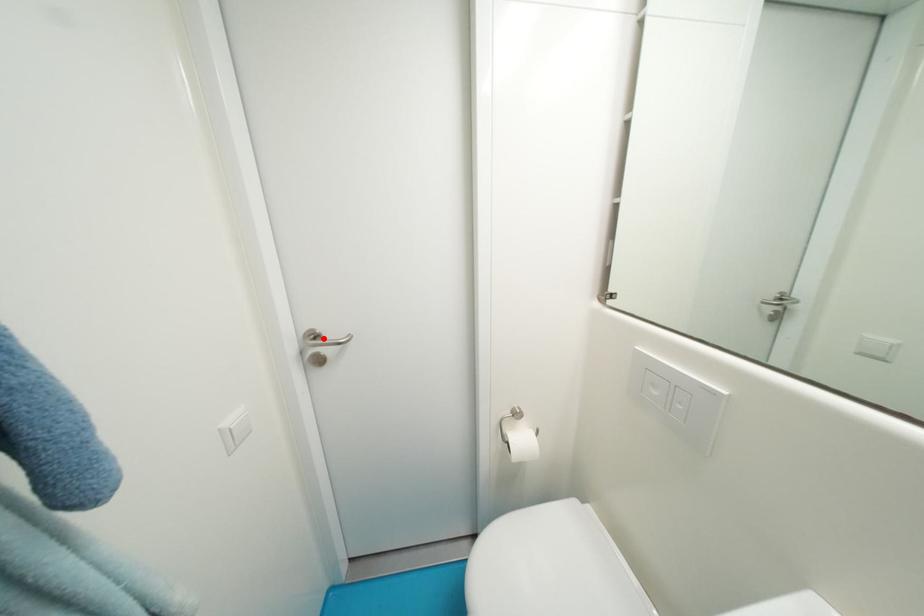
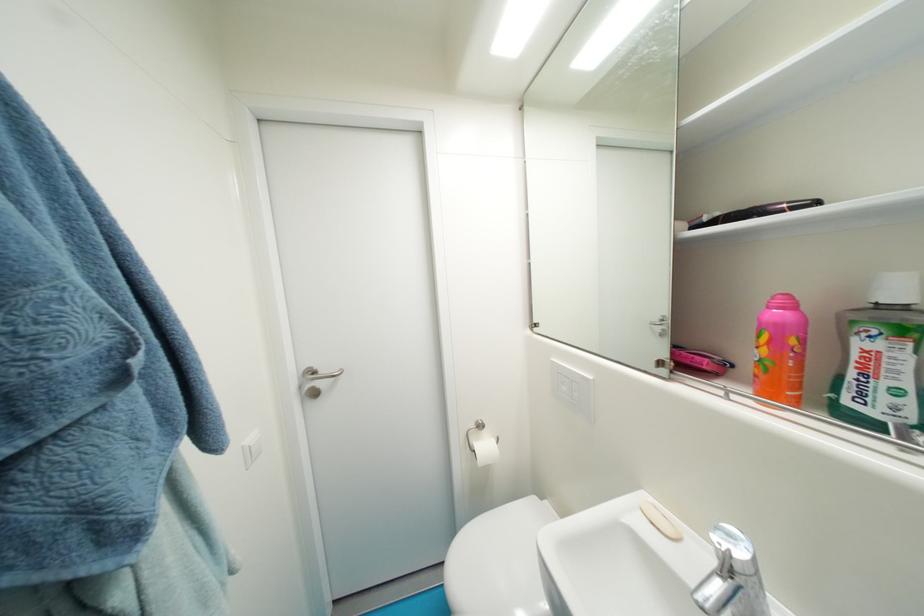
Find the pixel in the second image that matches the highlighted location in the first image.

(322, 374)